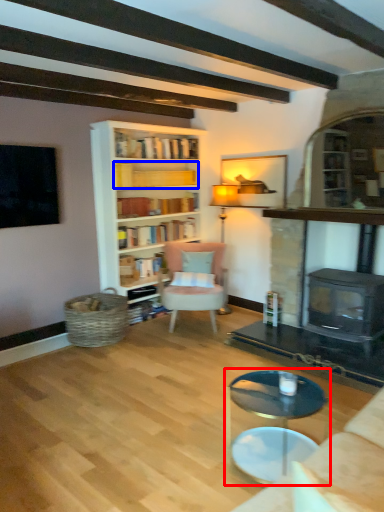
Question: Which of the following is the closest to the observer, coffee table (highlighted by a red box) or book (highlighted by a blue box)?

Choices:
 (A) coffee table
 (B) book

Answer: (A)